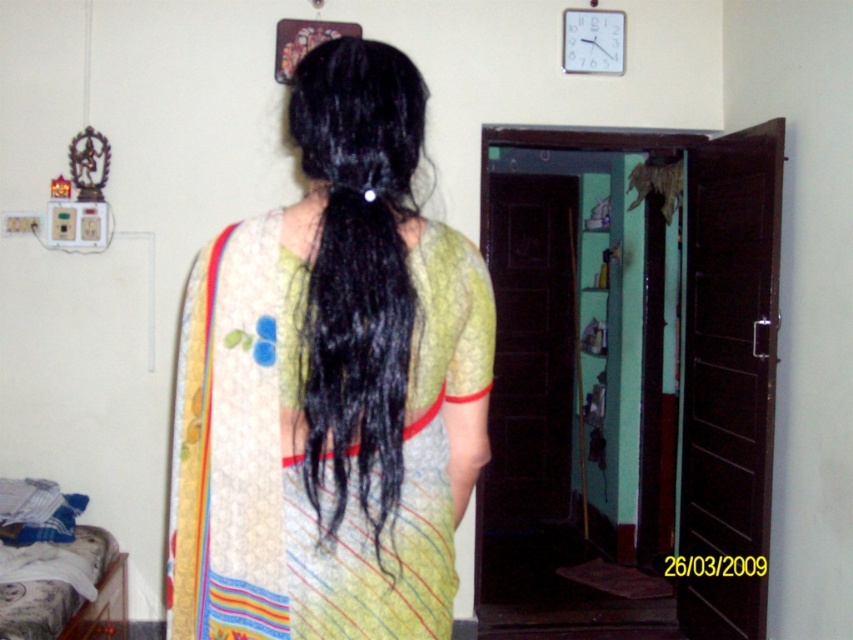
You are a photographer taking a portrait of the person wearing the silky yellow sari at center and the black silky hair at center. You want to ensure there is enough space between them for a natural pose. Given that the minimum recommended distance between the sari and hair for a comfortable pose is 2 inches, is the current spacing sufficient?

The silky yellow sari at center and black silky hair at center are 1.83 inches apart, which is less than the recommended 2 inches. Therefore, the current spacing is insufficient for a comfortable pose.

You are standing in the room and want to move from point (485, 275) to point (374, 323). Which direction should you move to get closer to the second point?

You should move towards the direction away from the viewer since point (485, 275) is further to the viewer than point (374, 323).

You are a fashion designer observing the person in the image. You need to determine whether the silky yellow sari at center can be used to cover the black silky hair at center completely. Based on their sizes, what would you advise?

The silky yellow sari at center is bigger than the black silky hair at center, so it can be used to cover the black silky hair at center completely.